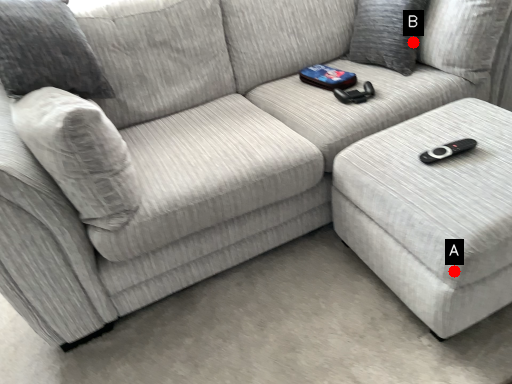
Question: Two points are circled on the image, labeled by A and B beside each circle. Which point appears closest to the camera in this image?

Choices:
 (A) A is closer
 (B) B is closer

Answer: (A)